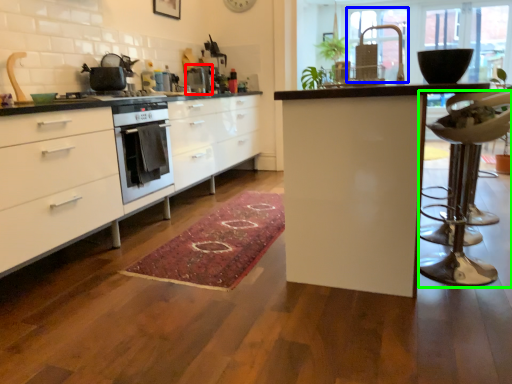
Question: Based on their relative distances, which object is farther from appliance (highlighted by a red box)? Choose from window screen (highlighted by a blue box) and swivel chair (highlighted by a green box).

Choices:
 (A) window screen
 (B) swivel chair

Answer: (A)